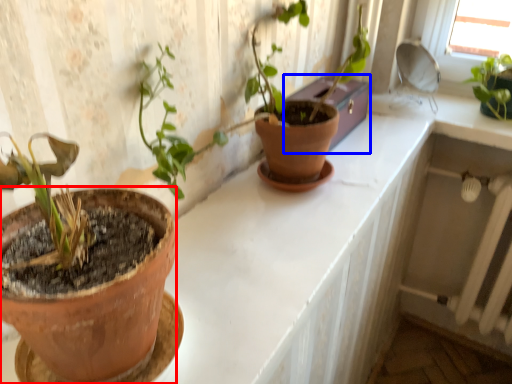
Question: Which point is further to the camera, flowerpot (highlighted by a red box) or window box (highlighted by a blue box)?

Choices:
 (A) flowerpot
 (B) window box

Answer: (B)